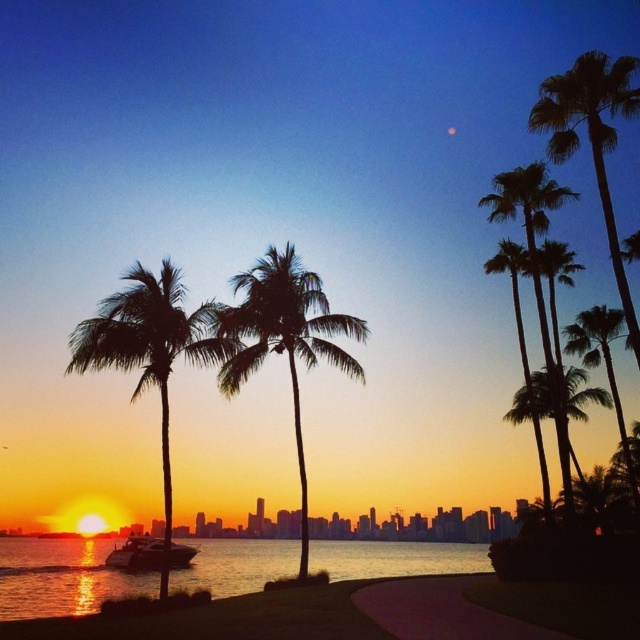
You are an artist trying to paint this sunset scene. You need to decide which object to paint first based on their sizes. Which one should you start with, the shiny reflective water at lower left or the silky black palm tree at right?

The shiny reflective water at lower left is bigger than the silky black palm tree at right, so you should start painting the shiny reflective water at lower left first because it takes up more space in the scene.